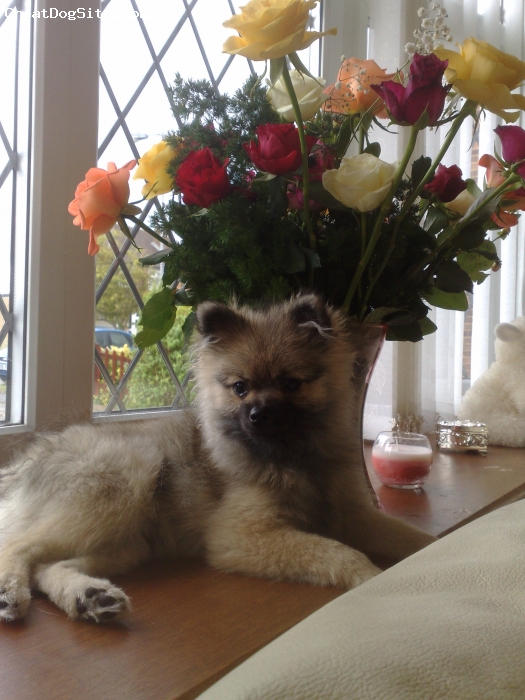
Find the location of a particular element. vertical white window blinds is located at coordinates (388, 46).